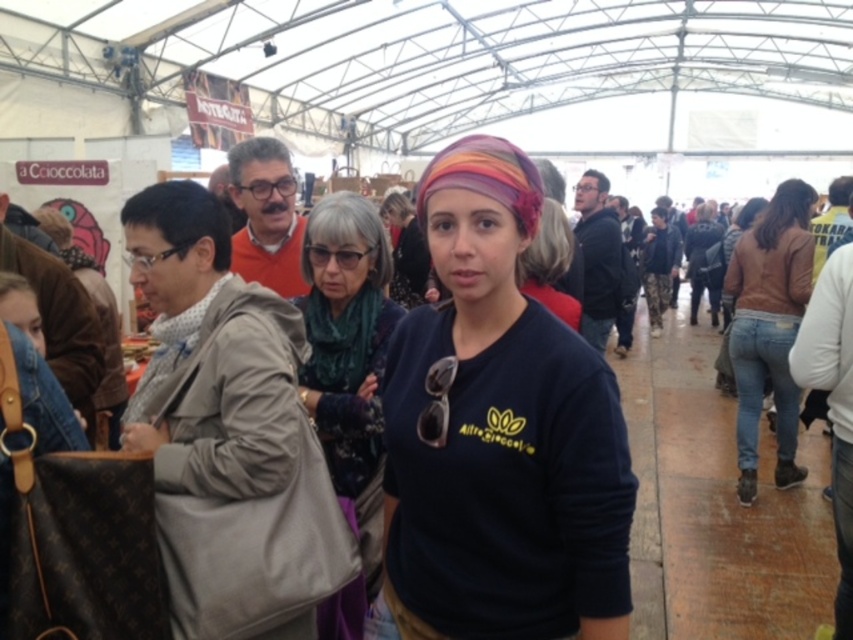
You are standing in the market and want to locate the dark green textured scarf at center. Where exactly is it positioned in the scene?

The dark green textured scarf at center is located at point coordinates of 0.553 on the x axis and 0.409 on the y axis.

You are a photographer standing at the back of the market. You want to take a photo of the dark blue jersey at center and the brown denim jeans at right in the same frame. Can you position yourself so that both are visible without moving either object? Explain your reasoning.

The distance between the dark blue jersey at center and brown denim jeans at right is 4.26 meters. Since the photographer is at the back of the market, the field of view of a standard camera lens can typically capture objects separated by this distance within the same frame, so yes, both can be included without moving either object.

You are a photographer at the market and want to capture both the dark green textured scarf at center and the brown denim jeans at right in your shot. Considering their heights, which object should you focus on first to ensure both are in frame?

The dark green textured scarf at center has a lesser height compared to the brown denim jeans at right. To ensure both are in frame, focus on the brown denim jeans at right first since it is taller and requires more vertical space.